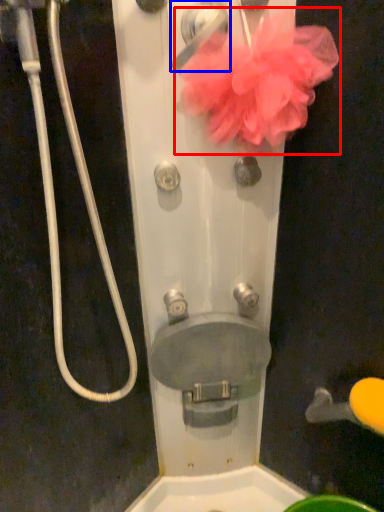
Question: Which object is further to the camera taking this photo, flower (highlighted by a red box) or door handle (highlighted by a blue box)?

Choices:
 (A) flower
 (B) door handle

Answer: (B)